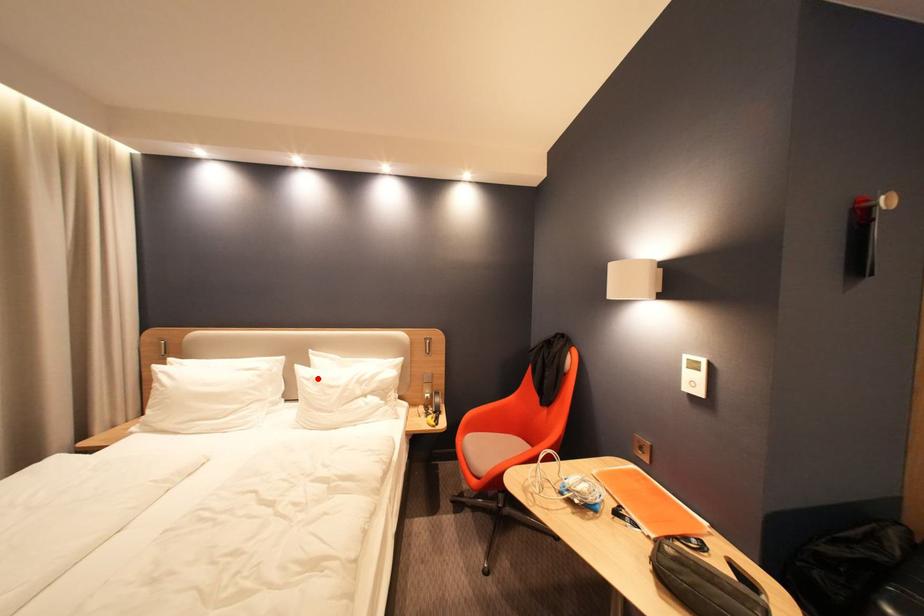
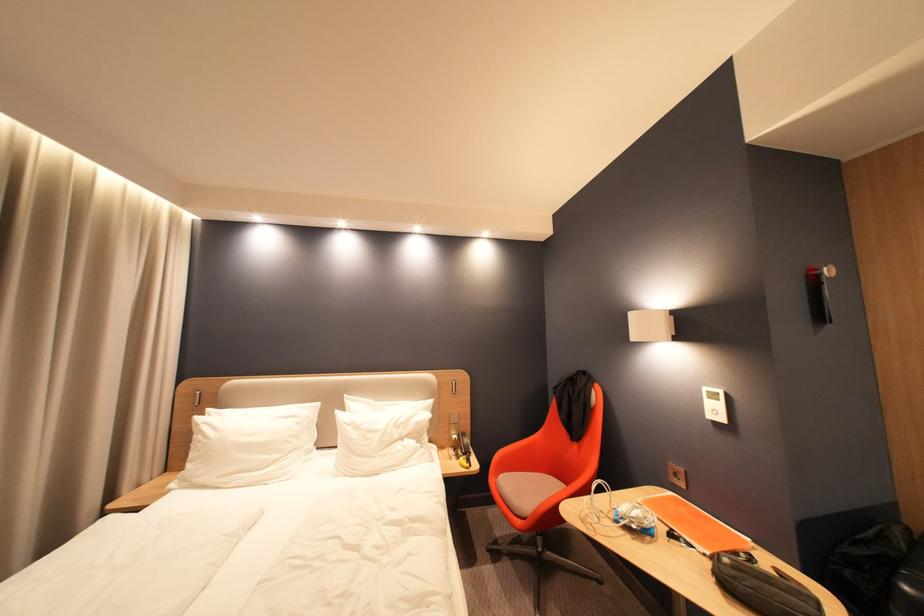
In the second image, find the point that corresponds to the highlighted location in the first image.

(359, 424)